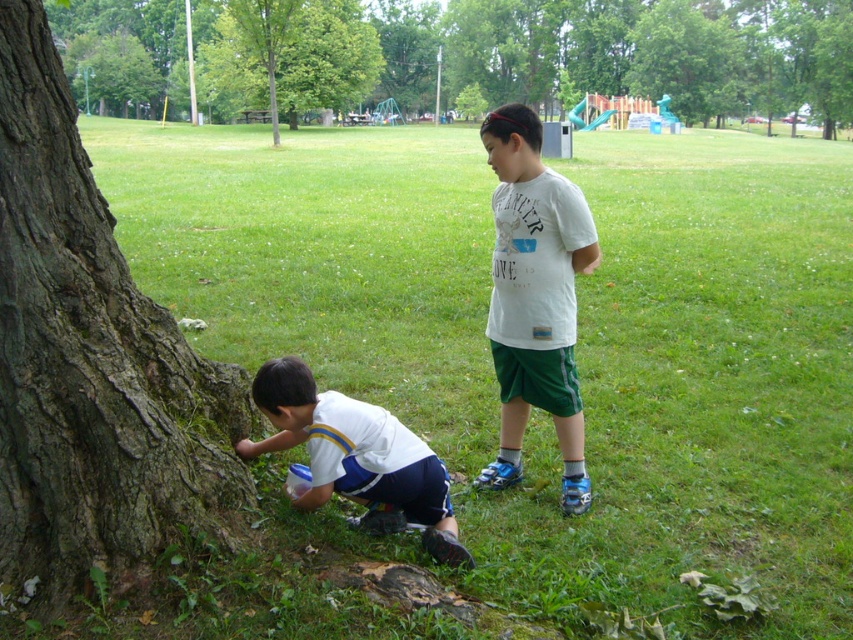
Question: Which point is farther to the camera?

Choices:
 (A) green leafy tree at upper center
 (B) white cotton shirt at center
 (C) smooth bark tree at left

Answer: (C)

Question: Considering the relative positions of smooth bark tree at left and green leafy tree at upper center in the image provided, where is smooth bark tree at left located with respect to green leafy tree at upper center?

Choices:
 (A) right
 (B) left

Answer: (A)

Question: Is green grass at lower left positioned behind green leafy tree at upper center?

Choices:
 (A) yes
 (B) no

Answer: (B)

Question: Does green grass at lower left appear on the left side of white cotton shirt at center?

Choices:
 (A) yes
 (B) no

Answer: (B)

Question: Which object is closer to the camera taking this photo?

Choices:
 (A) brown rough bark tree trunk at lower left
 (B) smooth bark tree at left
 (C) white matte shirt at lower left
 (D) green grass at lower left

Answer: (A)

Question: Which object is the farthest from the smooth bark tree at left?

Choices:
 (A) white matte shirt at lower left
 (B) green leafy tree at upper center
 (C) green grass at lower left

Answer: (A)